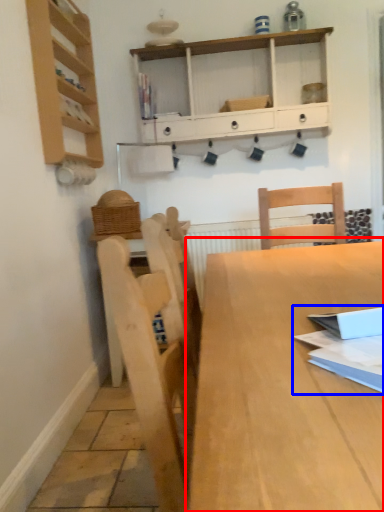
Question: Which of the following is the closest to the observer, table (highlighted by a red box) or book (highlighted by a blue box)?

Choices:
 (A) table
 (B) book

Answer: (A)